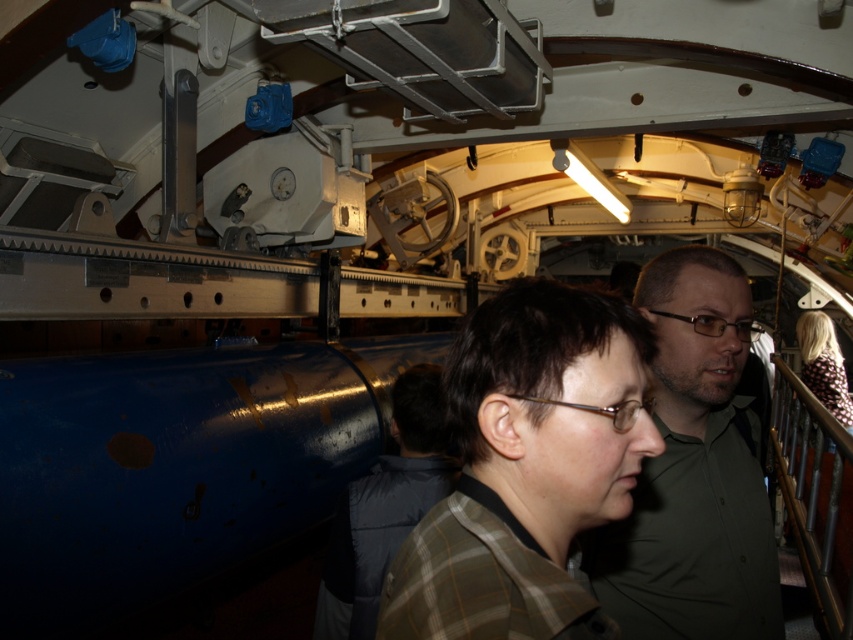
Locate an element on the screen. The image size is (853, 640). plaid fabric shirt at center is located at coordinates (527, 468).

Describe the element at coordinates (527, 468) in the screenshot. The height and width of the screenshot is (640, 853). I see `plaid fabric shirt at center` at that location.

Looking at this image, who is more distant from viewer, (474, 579) or (813, 358)?

Point (813, 358)

Where is `plaid fabric shirt at center`? The image size is (853, 640). plaid fabric shirt at center is located at coordinates (527, 468).

Does point (514, 292) come in front of point (650, 637)?

Yes, it is in front of point (650, 637).

Can you confirm if plaid fabric shirt at center is positioned below green matte shirt at center?

No.

Is point (465, 524) closer to camera compared to point (741, 472)?

Yes.

Locate an element on the screen. Image resolution: width=853 pixels, height=640 pixels. plaid fabric shirt at center is located at coordinates (527, 468).

Does plaid fabric shirt at center have a greater width compared to metallic polished rail at right?

In fact, plaid fabric shirt at center might be narrower than metallic polished rail at right.

Which is below, plaid fabric shirt at center or metallic polished rail at right?

Positioned lower is metallic polished rail at right.

Find the location of `plaid fabric shirt at center`. plaid fabric shirt at center is located at coordinates (527, 468).

At what (x,y) coordinates should I click in order to perform the action: click on plaid fabric shirt at center. Please return your answer as a coordinate pair (x, y). Image resolution: width=853 pixels, height=640 pixels. Looking at the image, I should click on (527, 468).